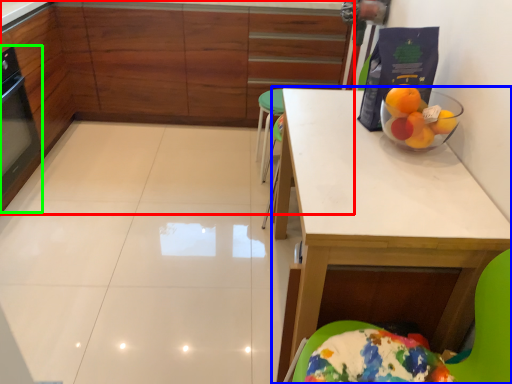
Question: Estimate the real-world distances between objects in this image. Which object is closer to cabinetry (highlighted by a red box), table (highlighted by a blue box) or appliance (highlighted by a green box)?

Choices:
 (A) table
 (B) appliance

Answer: (B)